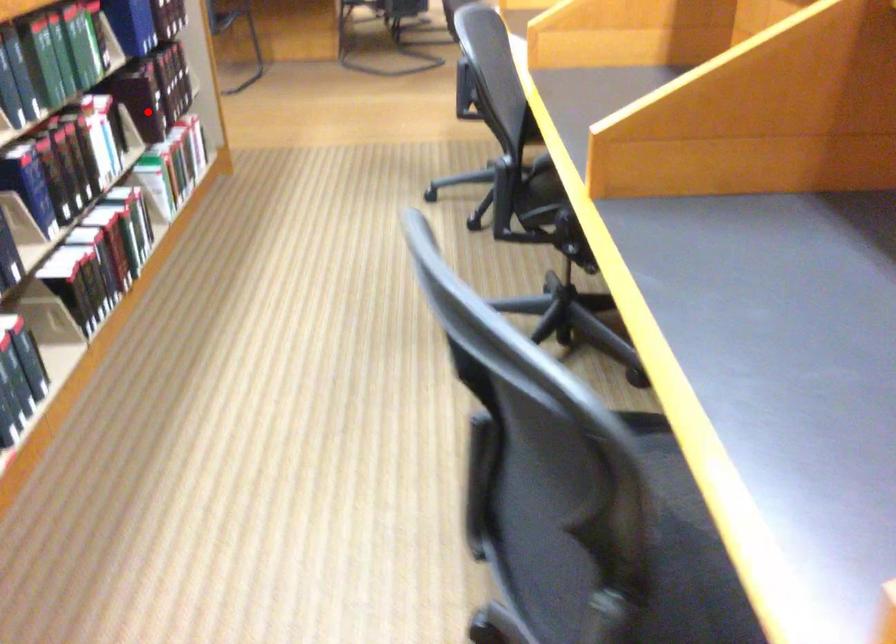
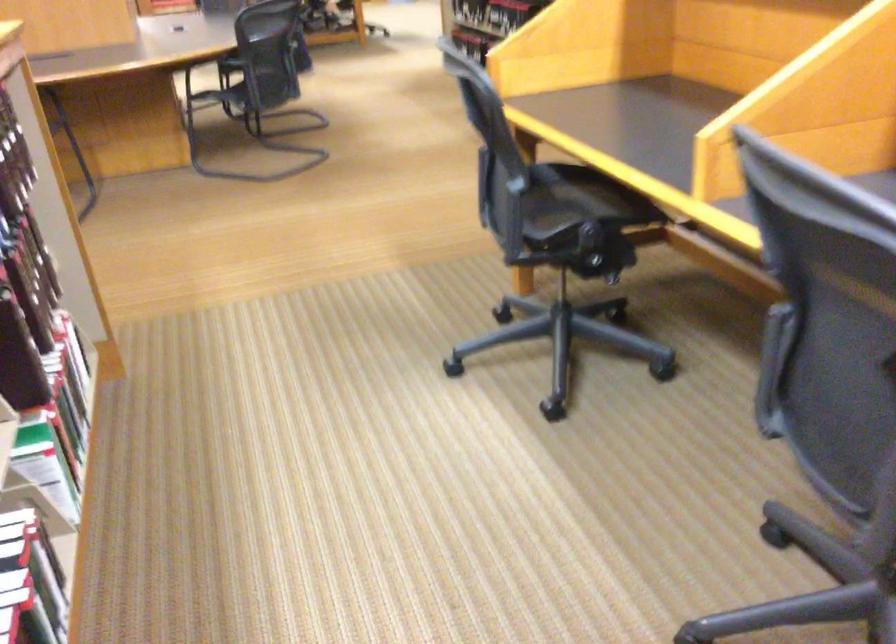
Question: I am providing you with two images of the same scene from different viewpoints. In image1, a red point is highlighted. Considering the same 3D point in image2, which of the following is correct?

Choices:
 (A) It is closer
 (B) It is farther

Answer: (A)